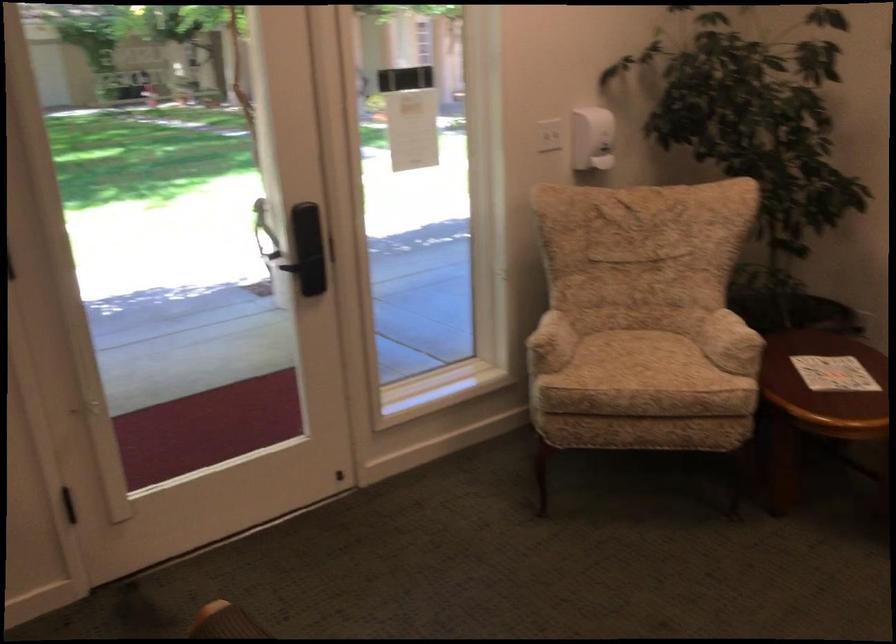
The width and height of the screenshot is (896, 644). I want to click on paper booklet, so pos(833,373).